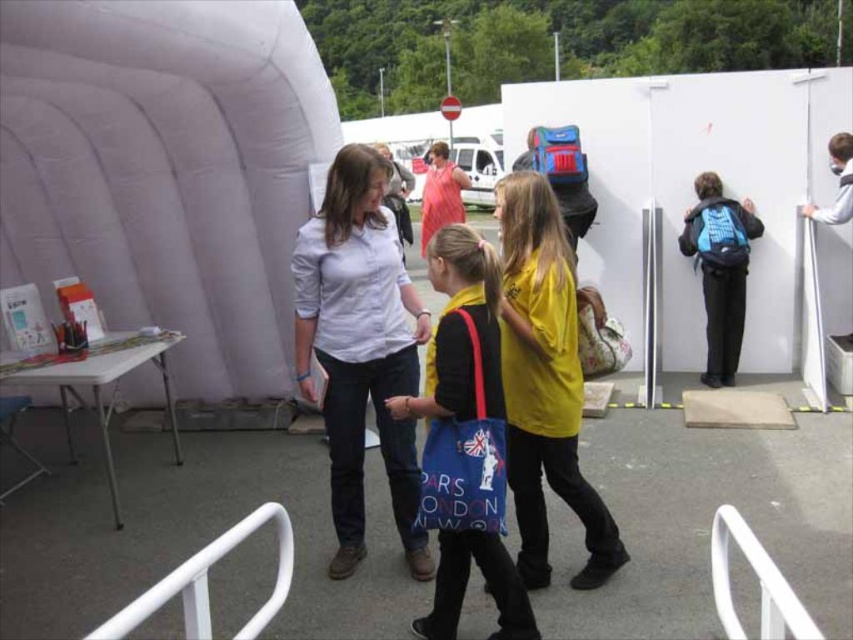
Question: Among these points, which one is nearest to the camera?

Choices:
 (A) (491, 314)
 (B) (550, 454)

Answer: (A)

Question: Which point is closer to the camera taking this photo?

Choices:
 (A) (492, 282)
 (B) (548, 326)

Answer: (A)

Question: Is yellow matte shirt at center further to the viewer compared to matte pink shirt at center?

Choices:
 (A) no
 (B) yes

Answer: (A)

Question: Which point is farther to the camera?

Choices:
 (A) blue fabric bag at center
 (B) yellow matte shirt at center
 (C) matte pink shirt at center

Answer: (C)

Question: Is yellow matte shirt at center to the left of matte pink shirt at center from the viewer's perspective?

Choices:
 (A) no
 (B) yes

Answer: (A)

Question: Can you confirm if yellow matte shirt at center is positioned to the left of matte pink shirt at center?

Choices:
 (A) no
 (B) yes

Answer: (A)